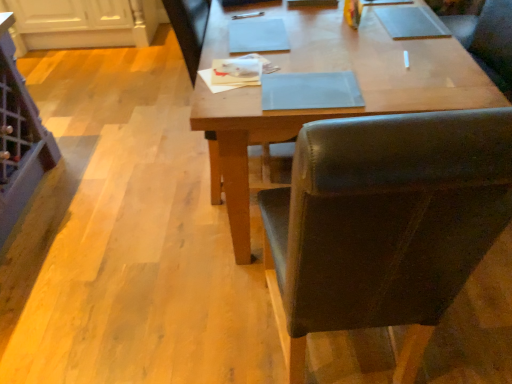
Where is `free region on the left part of brown leather chair at center`? free region on the left part of brown leather chair at center is located at coordinates (204, 324).